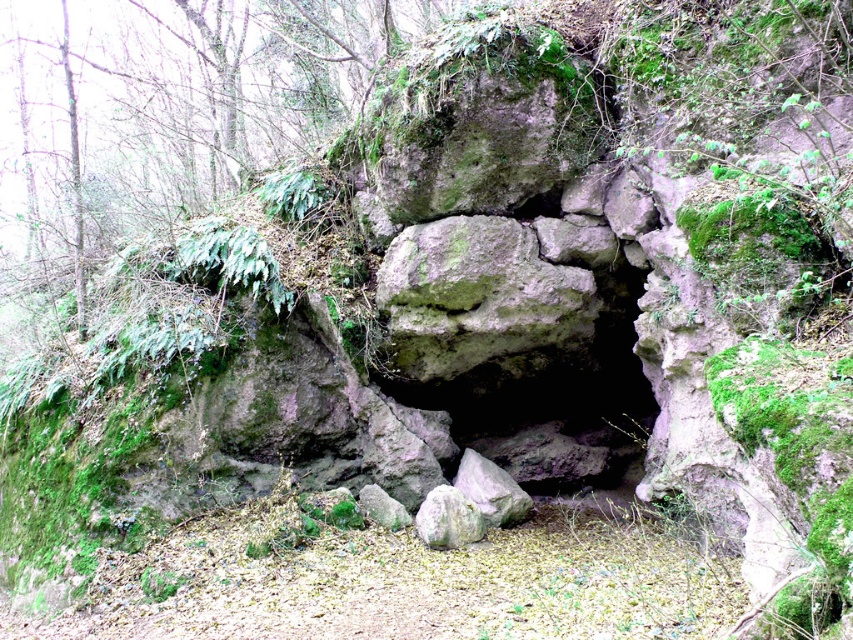
Question: Which object is farther from the camera taking this photo?

Choices:
 (A) gray rough rock at center
 (B) green mossy rock at center

Answer: (A)

Question: Is gray rough rock at center smaller than smooth gray rock at center?

Choices:
 (A) yes
 (B) no

Answer: (B)

Question: Does gray rough rock at center have a greater width compared to smooth gray rock at center?

Choices:
 (A) yes
 (B) no

Answer: (A)

Question: Is green mossy rock at center to the right of smooth gray rock at center from the viewer's perspective?

Choices:
 (A) yes
 (B) no

Answer: (A)

Question: Which point is farther from the camera taking this photo?

Choices:
 (A) (376, 506)
 (B) (459, 515)
 (C) (453, 276)

Answer: (A)

Question: Estimate the real-world distances between objects in this image. Which object is closer to the green mossy rock at center?

Choices:
 (A) smooth gray rock at center
 (B) gray rough rock at center

Answer: (B)